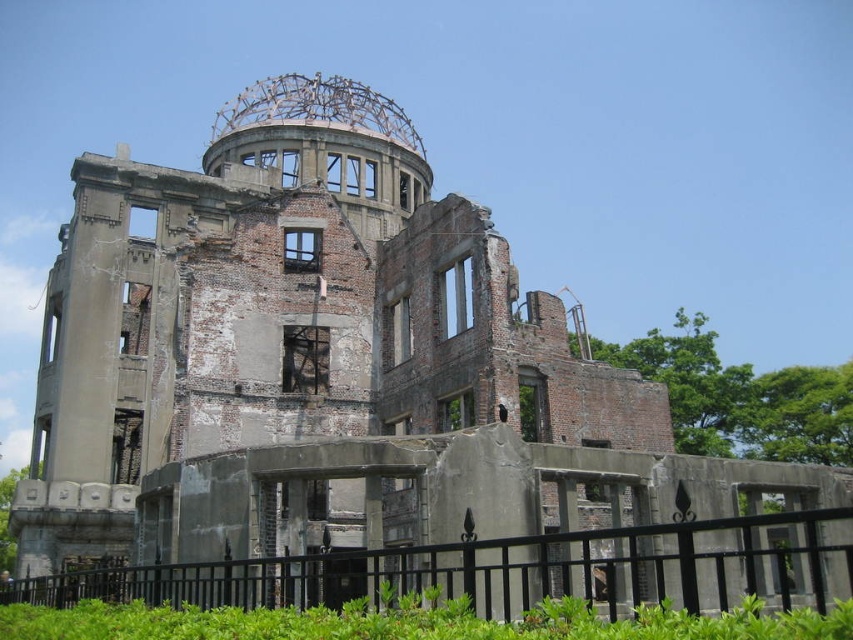
What are the coordinates of `concrete ruins at center` in the screenshot? It's located at (296, 301).

Can you confirm if concrete ruins at center is positioned above black metal fence at lower center?

Yes, concrete ruins at center is above black metal fence at lower center.

Which is behind, point (167, 385) or point (778, 552)?

The point (167, 385) is more distant.

You are a GUI agent. You are given a task and a screenshot of the screen. Output one action in this format:
    pyautogui.click(x=<x>, y=<y>)
    Task: Click on the concrete ruins at center
    Image resolution: width=853 pixels, height=640 pixels.
    Given the screenshot: What is the action you would take?
    pyautogui.click(x=296, y=301)